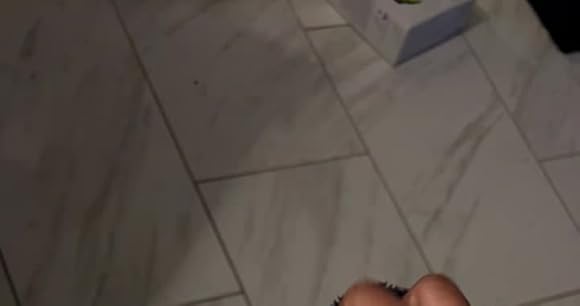
The height and width of the screenshot is (306, 580). Identify the location of floor. (280, 82).